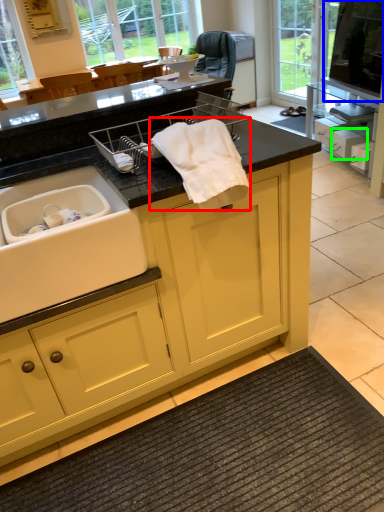
Question: Which object is the closest to the bath towel (highlighted by a red box)? Choose among these: window screen (highlighted by a blue box) or drawer (highlighted by a green box).

Choices:
 (A) window screen
 (B) drawer

Answer: (B)